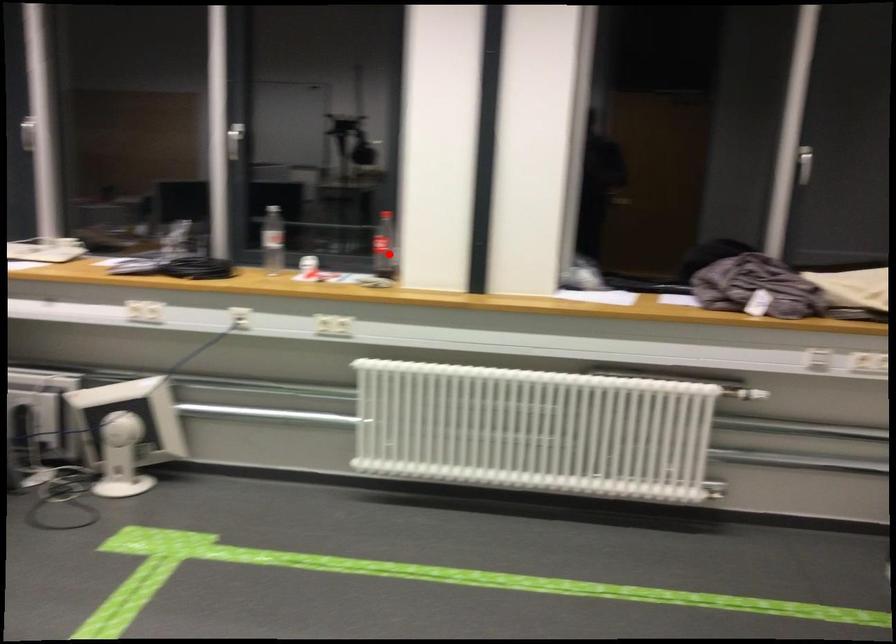
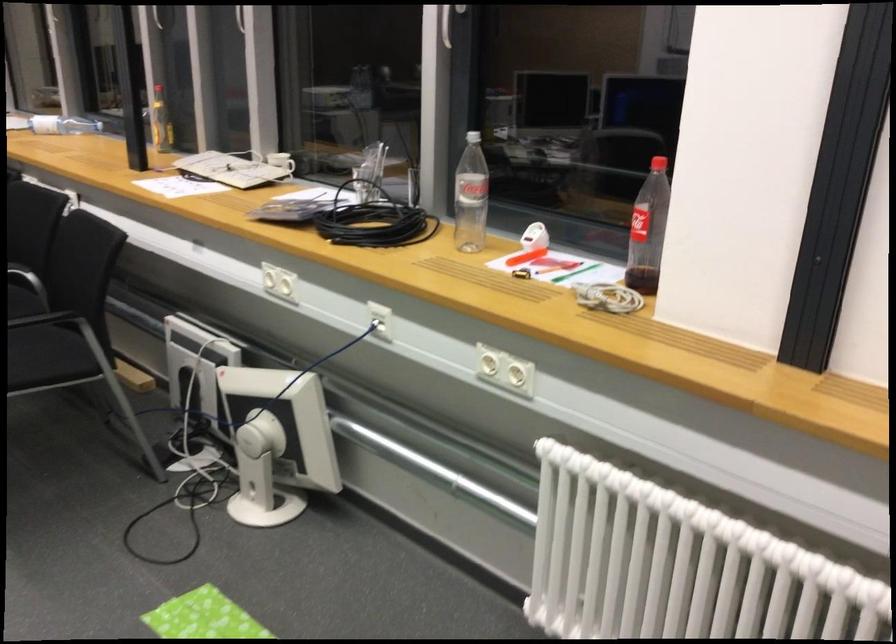
Find the pixel in the second image that matches the highlighted location in the first image.

(648, 230)